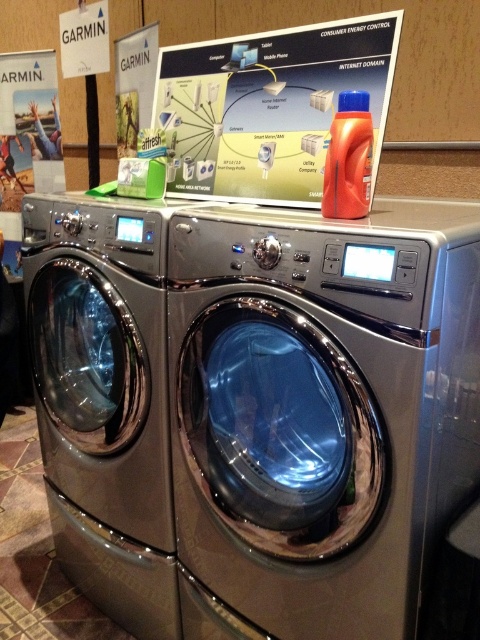
You are trying to determine which object is taller between the satin chrome washing machine at left and the white glossy poster at center. Based on the scene, which one is taller?

The satin chrome washing machine at left is much taller than the white glossy poster at center.

You are moving into a new apartment and need to decide which washing machine to place in a small laundry room. Based on the image, which of the two satin silver washing machine at center or satin chrome washing machine at left would be more suitable for limited space?

The satin silver washing machine at center has a smaller size compared to the satin chrome washing machine at left, so it would be more suitable for limited space.